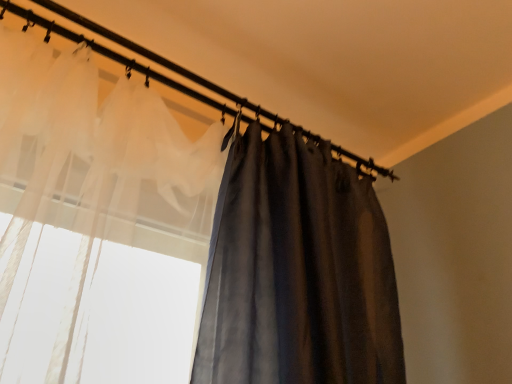
Find the location of a particular element. Image resolution: width=512 pixels, height=384 pixels. matte black curtain at upper center is located at coordinates (159, 60).

The image size is (512, 384). What do you see at coordinates (159, 60) in the screenshot?
I see `matte black curtain at upper center` at bounding box center [159, 60].

Where is `matte black curtain at upper center`? The height and width of the screenshot is (384, 512). matte black curtain at upper center is located at coordinates (159, 60).